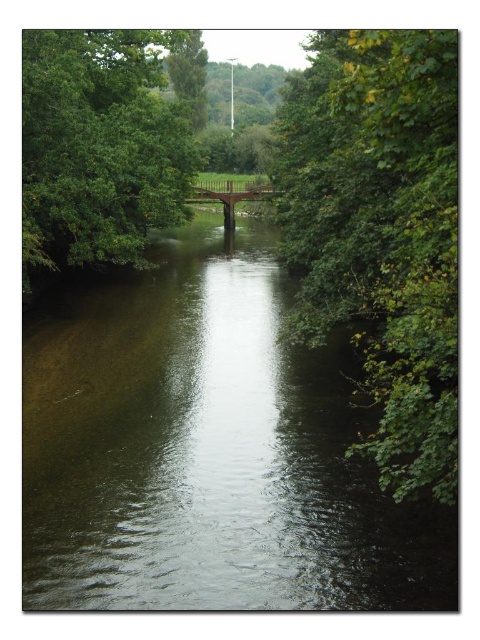
Who is shorter, green leafy tree at upper left or brown wooden bridge at center?

Standing shorter between the two is brown wooden bridge at center.

Does green leafy tree at upper left appear under brown wooden bridge at center?

Yes.

Describe the element at coordinates (98, 147) in the screenshot. This screenshot has height=640, width=480. I see `green leafy tree at upper left` at that location.

I want to click on green leafy tree at upper left, so click(x=98, y=147).

Which is below, green leafy tree at upper center or brown wooden bridge at center?

brown wooden bridge at center

Does green leafy tree at upper center have a lesser height compared to brown wooden bridge at center?

No, green leafy tree at upper center is not shorter than brown wooden bridge at center.

What are the coordinates of `green leafy tree at upper center` in the screenshot? It's located at (189, 74).

Is green leafy tree at right closer to the viewer compared to green leafy tree at upper left?

Yes.

Does green leafy tree at right have a greater width compared to green leafy tree at upper left?

Incorrect, green leafy tree at right's width does not surpass green leafy tree at upper left's.

Between point (371, 442) and point (168, 214), which one is positioned in front?

Point (371, 442) is in front.

Where is `green leafy tree at right`? Image resolution: width=480 pixels, height=640 pixels. green leafy tree at right is located at coordinates (381, 232).